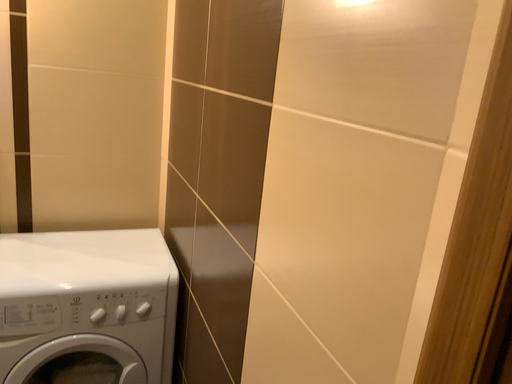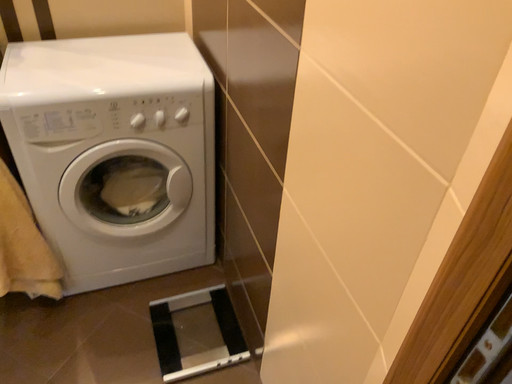
Question: How did the camera likely rotate when shooting the video?

Choices:
 (A) rotated upward
 (B) rotated downward

Answer: (B)